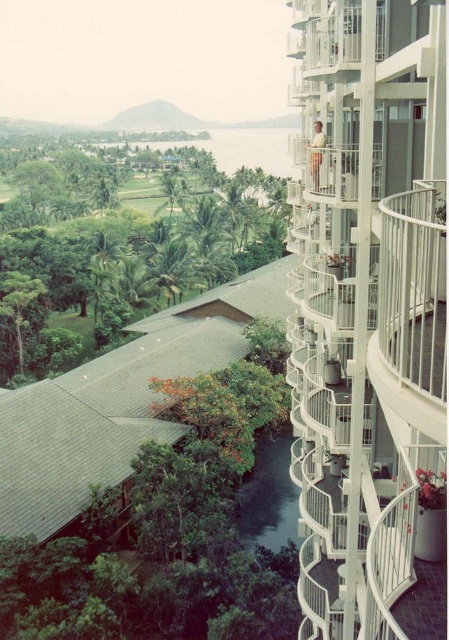
Is green leafy tree at center closer to camera compared to white metal balcony at upper center?

No, green leafy tree at center is behind white metal balcony at upper center.

Does green leafy tree at center appear over white metal balcony at upper center?

Yes.

Between point (80, 188) and point (351, 182), which one is positioned in front?

Point (351, 182) is more forward.

This screenshot has height=640, width=449. Find the location of `green leafy tree at center`. green leafy tree at center is located at coordinates (127, 243).

Which is behind, point (396, 579) or point (316, 188)?

The point (316, 188) is behind.

Can you confirm if white metal balcony at upper right is thinner than white metal balcony at upper center?

No, white metal balcony at upper right is not thinner than white metal balcony at upper center.

What do you see at coordinates (366, 301) in the screenshot? The width and height of the screenshot is (449, 640). I see `white metal balcony at upper right` at bounding box center [366, 301].

Where is `white metal balcony at upper right`? This screenshot has width=449, height=640. white metal balcony at upper right is located at coordinates (366, 301).

Does white metal balcony at upper right appear on the right side of green leafy tree at center?

Correct, you'll find white metal balcony at upper right to the right of green leafy tree at center.

Can you confirm if white metal balcony at upper right is thinner than green leafy tree at center?

Yes, white metal balcony at upper right is thinner than green leafy tree at center.

Does point (365, 436) come behind point (188, 230)?

No, it is in front of (188, 230).

I want to click on white metal balcony at upper right, so click(x=366, y=301).